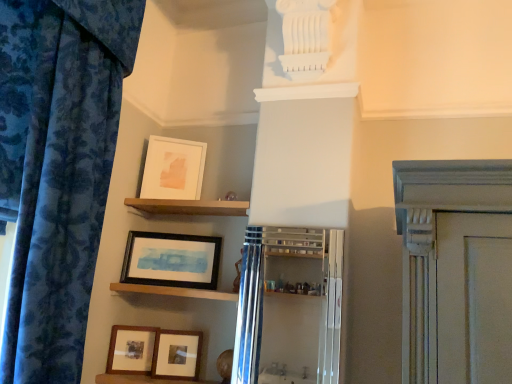
Question: Is matte white picture frame at upper center, the first picture frame in the top-to-bottom sequence, outside wooden matte picture frame at lower center, which ranks as the fourth picture frame in top-to-bottom order?

Choices:
 (A) no
 (B) yes

Answer: (B)

Question: Does matte white picture frame at upper center, the first picture frame in the top-to-bottom sequence, appear on the left side of wooden matte picture frame at lower center, which ranks as the fourth picture frame in top-to-bottom order?

Choices:
 (A) no
 (B) yes

Answer: (B)

Question: Does matte white picture frame at upper center, arranged as the 4th picture frame when ordered from the bottom, have a lesser height compared to wooden matte picture frame at lower center, which ranks as the fourth picture frame in top-to-bottom order?

Choices:
 (A) yes
 (B) no

Answer: (B)

Question: From the image's perspective, is matte white picture frame at upper center, arranged as the 4th picture frame when ordered from the bottom, located beneath wooden matte picture frame at lower center, positioned as the first picture frame in bottom-to-top order?

Choices:
 (A) yes
 (B) no

Answer: (B)

Question: Is matte white picture frame at upper center, arranged as the 4th picture frame when ordered from the bottom, smaller than wooden matte picture frame at lower center, which ranks as the fourth picture frame in top-to-bottom order?

Choices:
 (A) yes
 (B) no

Answer: (B)

Question: Is wooden matte picture frame at lower center, which ranks as the fourth picture frame in top-to-bottom order, inside the boundaries of matte black picture frame at lower left, the 3th picture frame in the top-to-bottom sequence, or outside?

Choices:
 (A) outside
 (B) inside

Answer: (A)

Question: Looking at the image, does wooden matte picture frame at lower center, positioned as the first picture frame in bottom-to-top order, seem bigger or smaller compared to matte black picture frame at lower left, the 3th picture frame in the top-to-bottom sequence?

Choices:
 (A) big
 (B) small

Answer: (B)

Question: Based on their positions, is wooden matte picture frame at lower center, positioned as the first picture frame in bottom-to-top order, located to the left or right of matte black picture frame at lower left, the 2th picture frame positioned from the bottom?

Choices:
 (A) left
 (B) right

Answer: (B)

Question: Considering their positions, is wooden matte picture frame at lower center, which ranks as the fourth picture frame in top-to-bottom order, located in front of or behind matte black picture frame at lower left, the 3th picture frame in the top-to-bottom sequence?

Choices:
 (A) front
 (B) behind

Answer: (A)

Question: Considering their positions, is wooden shelf at center, the 2th shelf positioned from the top, located in front of or behind wooden shelf at upper center, arranged as the 2th shelf when ordered from the bottom?

Choices:
 (A) front
 (B) behind

Answer: (A)

Question: Which is correct: wooden shelf at center, the 2th shelf positioned from the top, is inside wooden shelf at upper center, the first shelf in the top-to-bottom sequence, or outside of it?

Choices:
 (A) inside
 (B) outside

Answer: (B)

Question: From a real-world perspective, is wooden shelf at center, which is the 1th shelf in bottom-to-top order, physically located above or below wooden shelf at upper center, arranged as the 2th shelf when ordered from the bottom?

Choices:
 (A) below
 (B) above

Answer: (A)

Question: Is wooden shelf at center, the 2th shelf positioned from the top, wider or thinner than wooden shelf at upper center, the first shelf in the top-to-bottom sequence?

Choices:
 (A) wide
 (B) thin

Answer: (A)

Question: From the image's perspective, is matte black picture frame at lower left, the 3th picture frame in the top-to-bottom sequence, above or below wooden framed picture at center, arranged as the second picture frame when viewed from the top?

Choices:
 (A) below
 (B) above

Answer: (A)

Question: Relative to wooden framed picture at center, arranged as the second picture frame when viewed from the top, is matte black picture frame at lower left, the 2th picture frame positioned from the bottom, in front or behind?

Choices:
 (A) front
 (B) behind

Answer: (A)